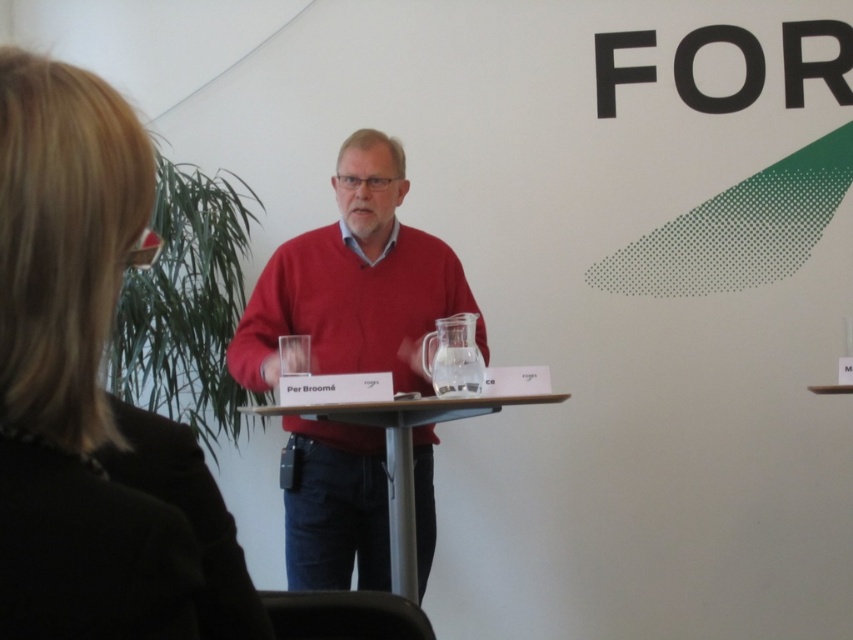
Is black fabric hair at upper left taller than wooden table at center?

Incorrect, black fabric hair at upper left's height is not larger of wooden table at center's.

Can you confirm if black fabric hair at upper left is positioned to the right of wooden table at center?

In fact, black fabric hair at upper left is to the left of wooden table at center.

Locate an element on the screen. This screenshot has width=853, height=640. black fabric hair at upper left is located at coordinates point(91,392).

You are a GUI agent. You are given a task and a screenshot of the screen. Output one action in this format:
    pyautogui.click(x=<x>, y=<y>)
    Task: Click on the black fabric hair at upper left
    This screenshot has height=640, width=853.
    Given the screenshot: What is the action you would take?
    pyautogui.click(x=91, y=392)

Is point (364, 355) positioned behind point (387, 497)?

Yes, it is.

Does matte red sweater at center appear on the left side of wooden table at center?

Yes, matte red sweater at center is to the left of wooden table at center.

Which is behind, point (318, 536) or point (405, 513)?

Point (318, 536)

What are the coordinates of `matte red sweater at center` in the screenshot? It's located at [352, 282].

What do you see at coordinates (91, 392) in the screenshot? I see `black fabric hair at upper left` at bounding box center [91, 392].

Is black fabric hair at upper left closer to camera compared to matte red sweater at center?

Yes.

Is point (25, 410) positioned behind point (418, 232)?

No, it is in front of (418, 232).

You are a GUI agent. You are given a task and a screenshot of the screen. Output one action in this format:
    pyautogui.click(x=<x>, y=<y>)
    Task: Click on the black fabric hair at upper left
    
    Given the screenshot: What is the action you would take?
    pyautogui.click(x=91, y=392)